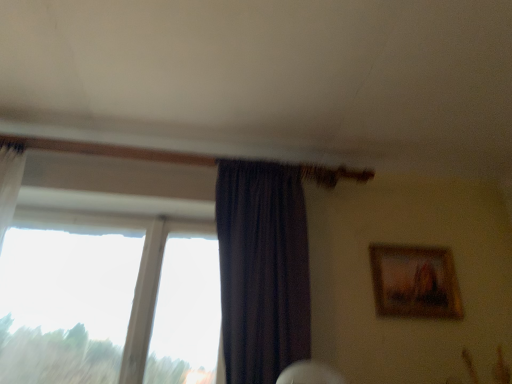
Question: From their relative heights in the image, would you say wooden framed painting at upper right is taller or shorter than dark purple sheer at center?

Choices:
 (A) short
 (B) tall

Answer: (A)

Question: Is wooden framed painting at upper right spatially inside dark purple sheer at center, or outside of it?

Choices:
 (A) outside
 (B) inside

Answer: (A)

Question: Estimate the real-world distances between objects in this image. Which object is closer to the transparent glass window at left?

Choices:
 (A) wooden framed painting at upper right
 (B) dark purple sheer at center

Answer: (B)

Question: Which object is the closest to the wooden framed painting at upper right?

Choices:
 (A) transparent glass window at left
 (B) dark purple sheer at center

Answer: (B)